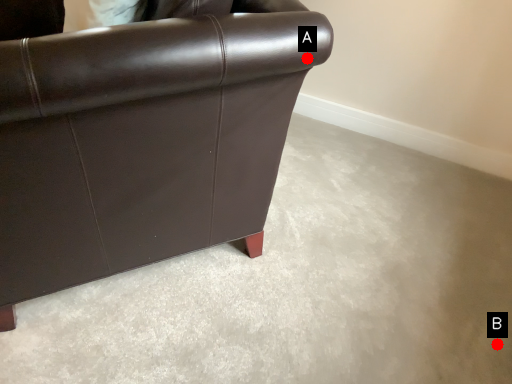
Question: Two points are circled on the image, labeled by A and B beside each circle. Which point appears farthest from the camera in this image?

Choices:
 (A) A is further
 (B) B is further

Answer: (B)